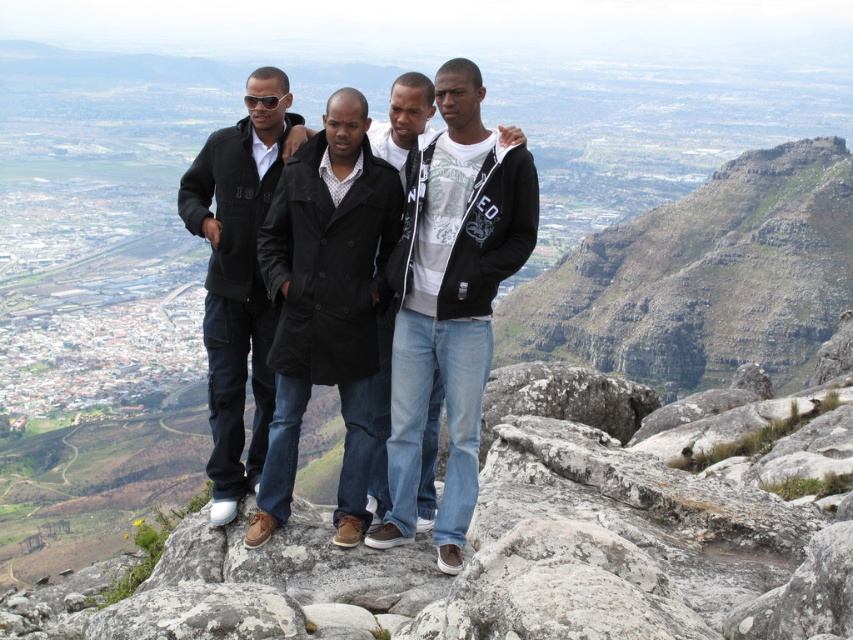
You are a hiker who has just reached the top of the rugged stone mountain at upper right. You want to take a photo of the sprawling urban area below. Which direction should you face to capture the city in your photo?

The rugged stone mountain at upper right is positioned at coordinates point (701, 276). Since the urban area is in the background of the scene, facing towards the lower part of the image where the city is located would allow you to capture it in your photo.

You are a photographer trying to capture a clear shot of the rugged stone mountain at upper right and the black fleece jacket at center. However, the jacket is partially blocking the mountain. Can you adjust your position to frame both elements without obstruction?

The black fleece jacket at center is behind the rugged stone mountain at upper right, so moving your position to the side might allow you to see both elements without obstruction.